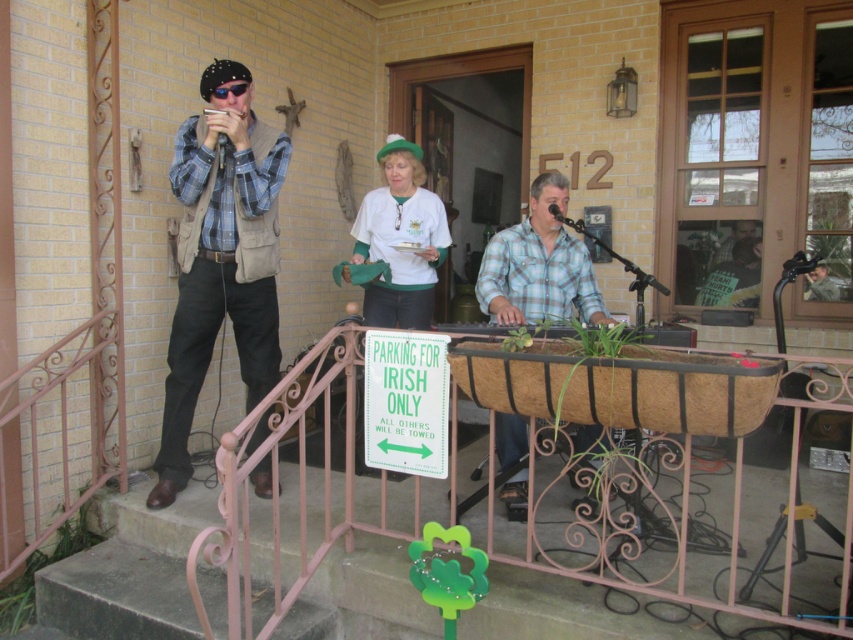
You are a person who is 6 feet tall and standing at the bottom of the concrete stairs at lower left. You want to read the text on the green plastic sign at center. Can you reach the sign without climbing the stairs?

The concrete stairs at lower left is 35.87 inches away from green plastic sign at center. Since you are 6 feet tall, which is 72 inches, and the sign is only 35.87 inches away, you can easily reach the sign without climbing the stairs.

You are standing on the porch of the brick building at 512. You need to walk to the green plastic sign at center to read it. Which direction should you move relative to the concrete stairs at lower left?

To reach the green plastic sign at center, you should move away from the concrete stairs at lower left because the green plastic sign at center is behind the concrete stairs at lower left.